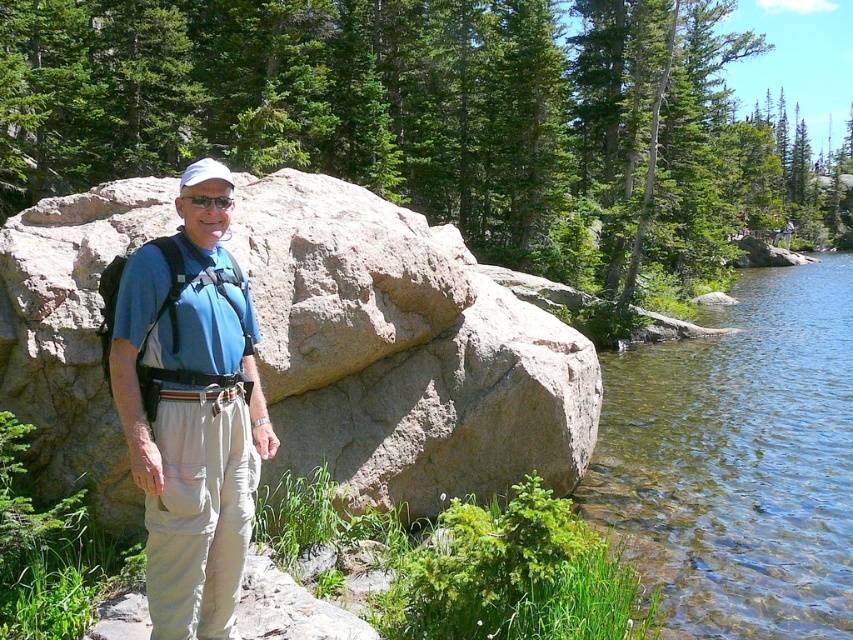
You are a photographer taking a picture of the clear water at lower right and the blue fabric shirt at center. Which object will appear closer to the camera in the photo?

The clear water at lower right appears closer to the camera because the blue fabric shirt at center is behind it.

Looking at this image, you are a hiker who just arrived at the scene and wants to take a photo of the clear water at lower right. Where should you position yourself to capture it in the frame?

The clear water at lower right is located at point 0.720 on the x axis and 0.868 on the y axis, so you should position yourself to the lower right of the scene to capture it in the frame.

You are a photographer trying to capture the clear water at lower right and the matte black goggles at center in the same frame. Which object should you focus on first if you want to ensure both are in sharp focus?

The clear water at lower right is bigger than the matte black goggles at center, so focusing on the clear water at lower right first would help ensure both are in sharp focus because larger objects often require more precise focus adjustments.